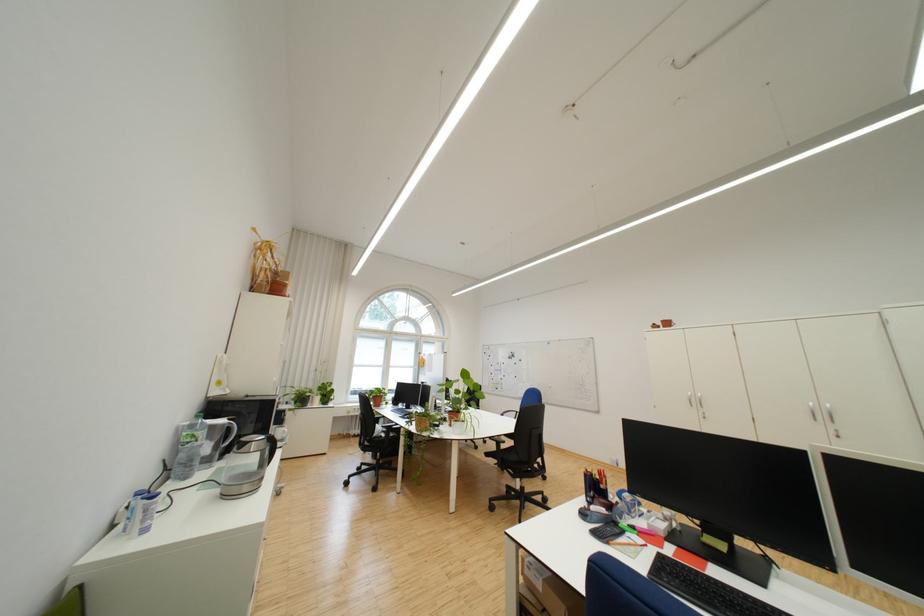
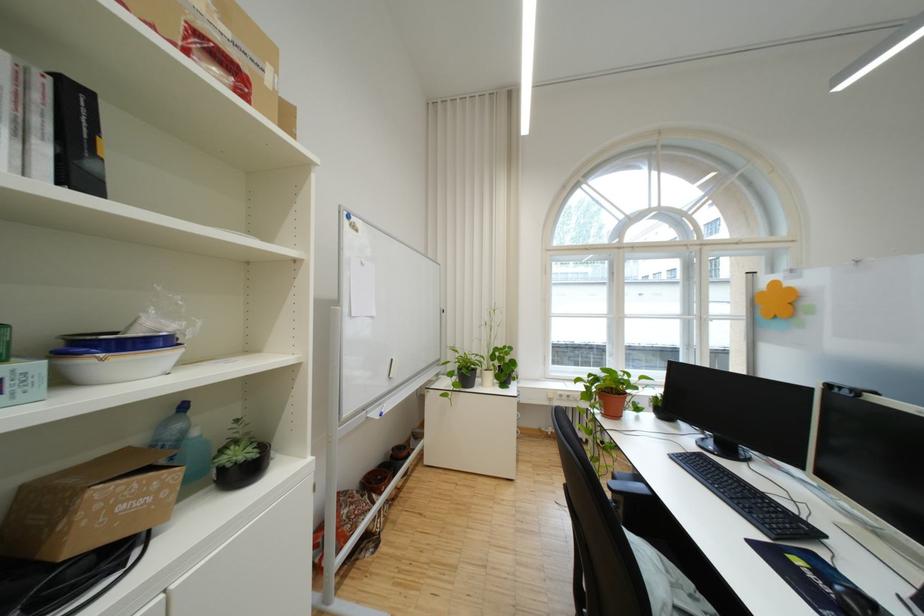
Where in the second image is the point corresponding to point 334,400 from the first image?

(508, 379)